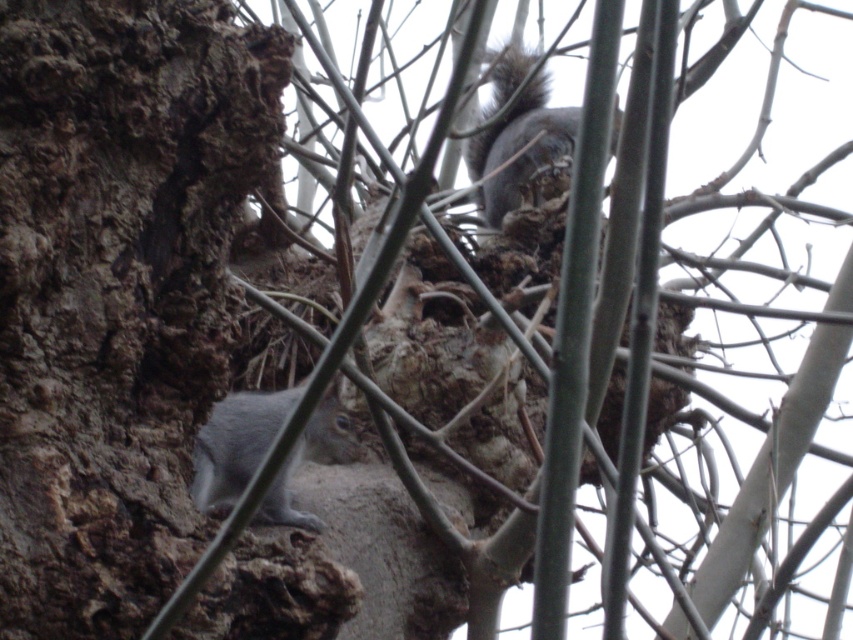
Question: Which point is farther to the camera?

Choices:
 (A) (165, 282)
 (B) (196, 467)

Answer: (B)

Question: In this image, where is brown rough bark at left located relative to gray fur squirrel at upper center?

Choices:
 (A) right
 (B) left

Answer: (B)

Question: Can you confirm if brown rough bark at left is bigger than gray fur squirrel at upper center?

Choices:
 (A) no
 (B) yes

Answer: (B)

Question: Which point appears closest to the camera in this image?

Choices:
 (A) (338, 438)
 (B) (73, 179)

Answer: (B)

Question: Is brown rough bark at left positioned behind gray fur tail at lower left?

Choices:
 (A) no
 (B) yes

Answer: (A)

Question: Which of the following is the closest to the observer?

Choices:
 (A) (474, 134)
 (B) (225, 410)
 (C) (198, 508)

Answer: (C)